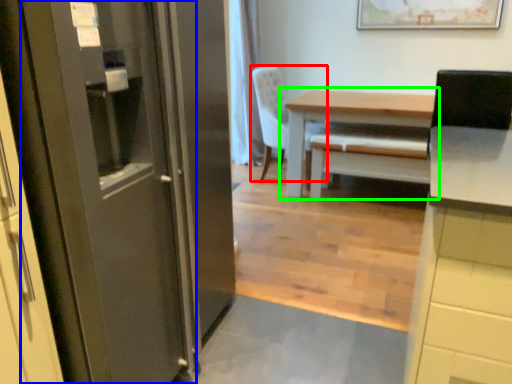
Question: Which is farther away from chair (highlighted by a red box)? door (highlighted by a blue box) or table (highlighted by a green box)?

Choices:
 (A) door
 (B) table

Answer: (A)